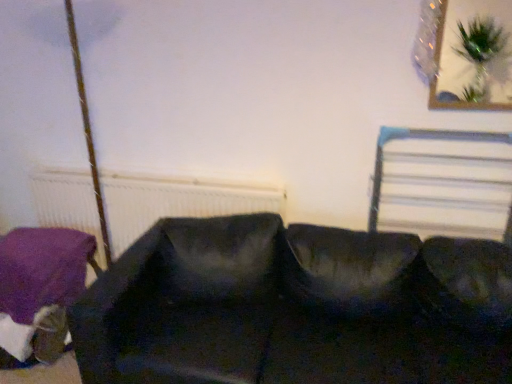
Question: Looking at the image, does white textured radiator at left seem bigger or smaller compared to metallic silver bed frame at upper right?

Choices:
 (A) big
 (B) small

Answer: (A)

Question: Is white textured radiator at left in front of or behind metallic silver bed frame at upper right in the image?

Choices:
 (A) front
 (B) behind

Answer: (B)

Question: Based on their relative distances, which object is nearer to the black fabric couch at center?

Choices:
 (A) white textured radiator at left
 (B) purple fabric cushion at lower left
 (C) metallic silver bed frame at upper right

Answer: (A)

Question: Which is farther from the purple fabric cushion at lower left?

Choices:
 (A) black fabric couch at center
 (B) metallic silver bed frame at upper right
 (C) white textured radiator at left

Answer: (B)